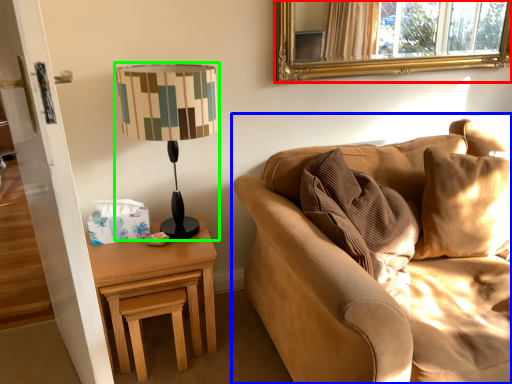
Question: Considering the real-world distances, which object is farthest from mirror (highlighted by a red box)? studio couch (highlighted by a blue box) or lamp (highlighted by a green box)?

Choices:
 (A) studio couch
 (B) lamp

Answer: (B)